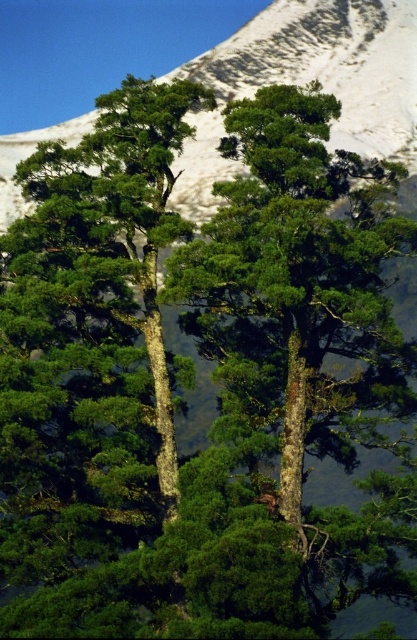
Does green rough bark tree at center appear on the right side of snowy white mountain at upper center?

Indeed, green rough bark tree at center is positioned on the right side of snowy white mountain at upper center.

Between point (354, 241) and point (412, 102), which one is positioned in front?

Point (354, 241) is in front.

Locate an element on the screen. Image resolution: width=417 pixels, height=640 pixels. green rough bark tree at center is located at coordinates (298, 288).